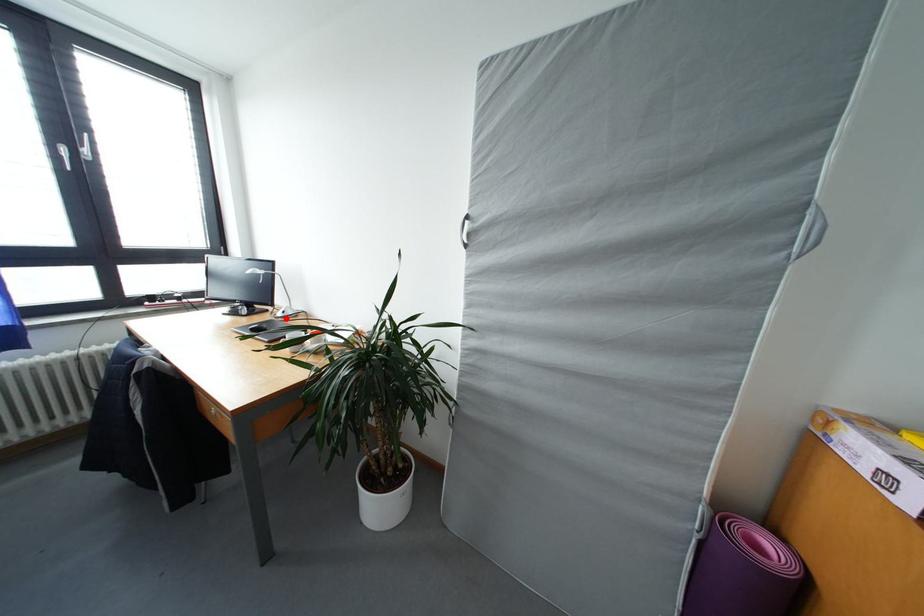
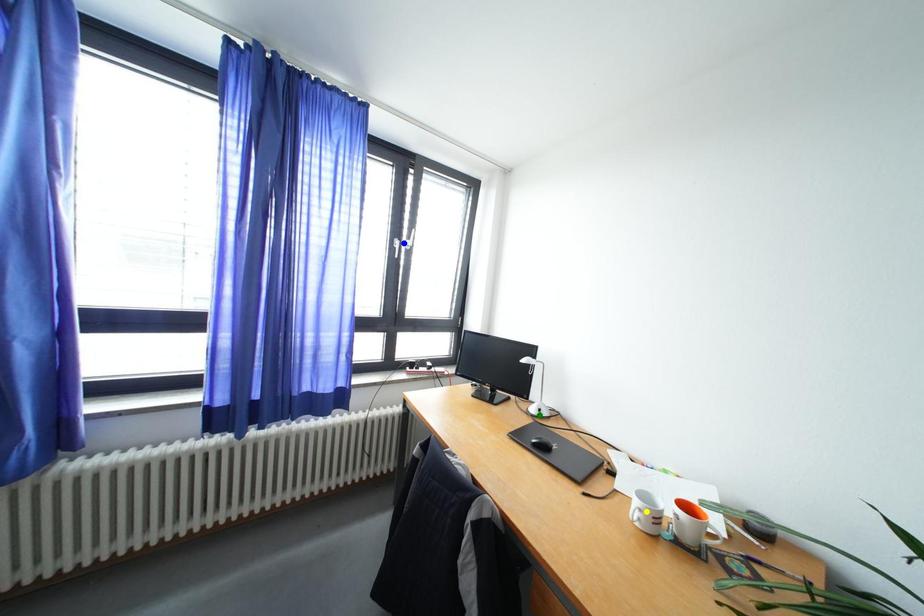
Question: I am providing you with two images of the same scene from different viewpoints. A red point is marked on the first image. You are given multiple points on the second image. Which point in image 2 represents the same 3d spot as the red point in image 1?

Choices:
 (A) yellow point
 (B) blue point
 (C) green point

Answer: (C)